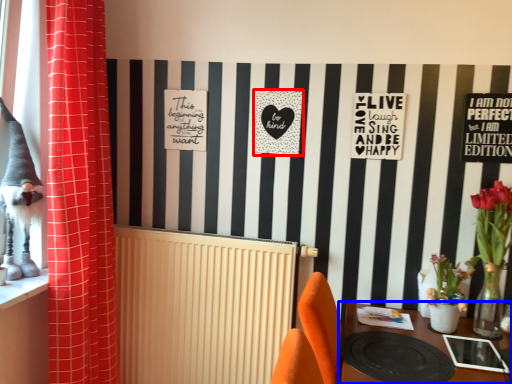
Question: Which object is further to the camera taking this photo, postcard (highlighted by a red box) or table (highlighted by a blue box)?

Choices:
 (A) postcard
 (B) table

Answer: (A)